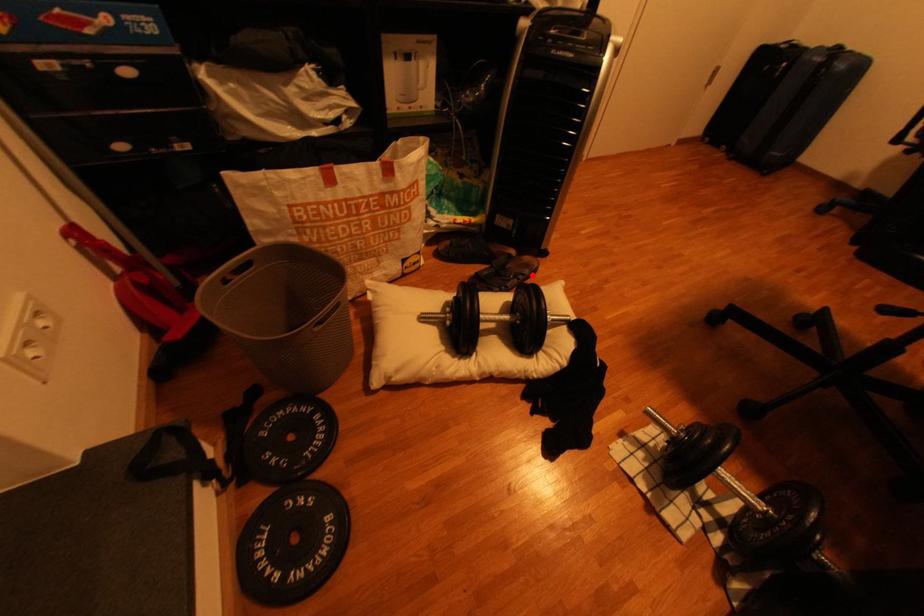
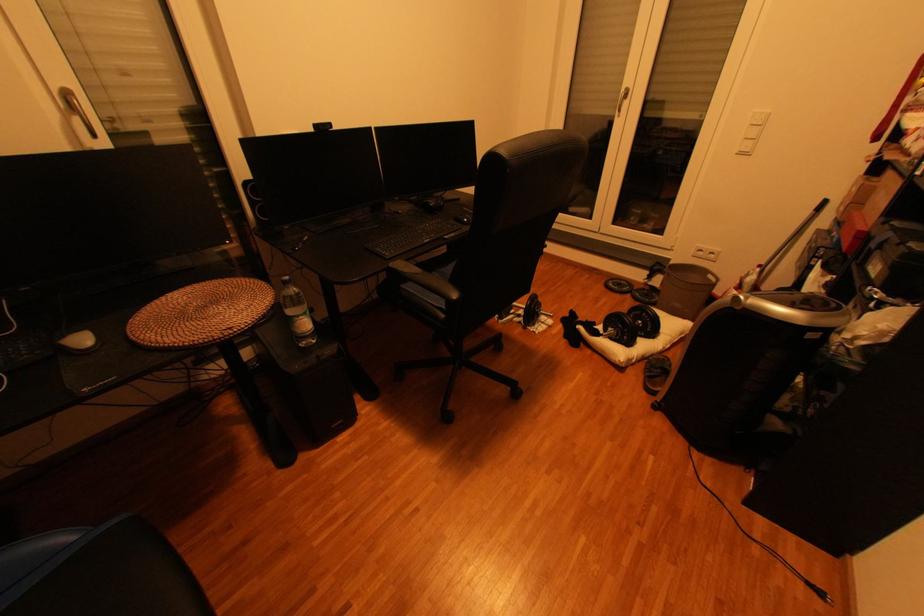
Question: I am providing you with two images of the same scene from different viewpoints. A red point is shown in image1. For the corresponding object point in image2, is it positioned nearer or farther from the camera?

Choices:
 (A) Nearer
 (B) Farther

Answer: (A)